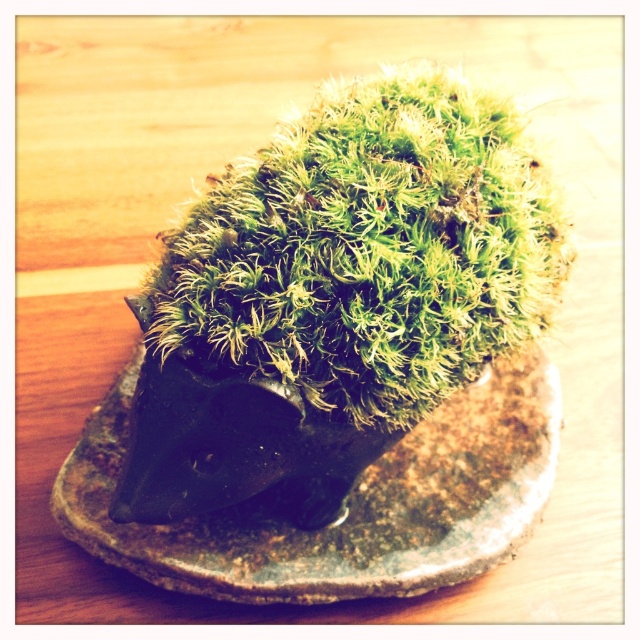
Does green mossy hedgehog at center have a greater width compared to green mossy stone at center?

In fact, green mossy hedgehog at center might be narrower than green mossy stone at center.

Who is more distant from viewer, (342, 220) or (269, 515)?

The point (269, 515) is more distant.

Where is `green mossy hedgehog at center`? This screenshot has width=640, height=640. green mossy hedgehog at center is located at coordinates (368, 250).